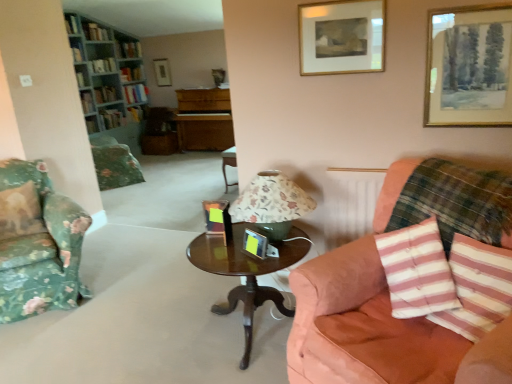
This screenshot has height=384, width=512. I want to click on vacant point above dark wood coffee table at center (from a real-world perspective), so click(238, 252).